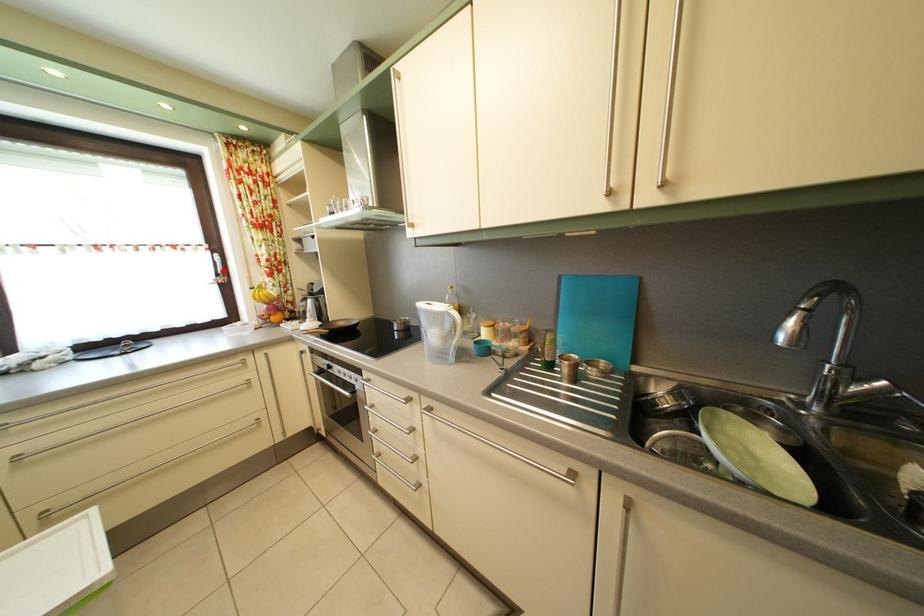
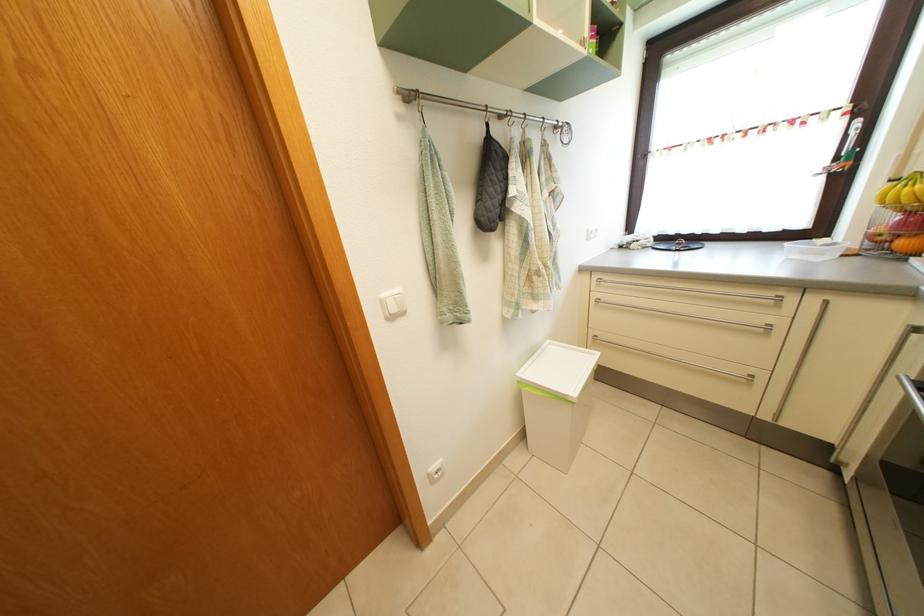
Locate, in the second image, the point that corresponds to the highlighted location in the first image.

(853, 146)